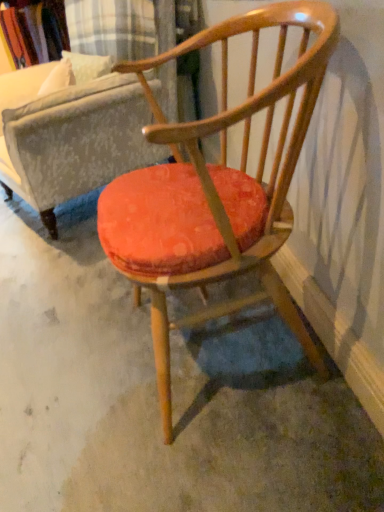
Question: Is wooden armchair at center closer to the viewer compared to orange fabric cushion at center?

Choices:
 (A) no
 (B) yes

Answer: (B)

Question: Is wooden armchair at center looking in the opposite direction of orange fabric cushion at center?

Choices:
 (A) yes
 (B) no

Answer: (B)

Question: From a real-world perspective, does wooden armchair at center sit lower than orange fabric cushion at center?

Choices:
 (A) yes
 (B) no

Answer: (B)

Question: Is wooden armchair at center positioned behind orange fabric cushion at center?

Choices:
 (A) no
 (B) yes

Answer: (A)

Question: Is wooden armchair at center far away from orange fabric cushion at center?

Choices:
 (A) no
 (B) yes

Answer: (A)

Question: Is velvet orange cushion at center bigger or smaller than wooden armchair at center?

Choices:
 (A) small
 (B) big

Answer: (B)

Question: From a real-world perspective, is velvet orange cushion at center above or below wooden armchair at center?

Choices:
 (A) above
 (B) below

Answer: (A)

Question: Is velvet orange cushion at center taller or shorter than wooden armchair at center?

Choices:
 (A) short
 (B) tall

Answer: (B)

Question: From the image's perspective, is velvet orange cushion at center positioned above or below wooden armchair at center?

Choices:
 (A) above
 (B) below

Answer: (A)

Question: Would you say orange fabric cushion at center is inside or outside velvet orange cushion at center?

Choices:
 (A) inside
 (B) outside

Answer: (B)

Question: Looking at their shapes, would you say orange fabric cushion at center is wider or thinner than velvet orange cushion at center?

Choices:
 (A) wide
 (B) thin

Answer: (A)

Question: Based on their sizes in the image, would you say orange fabric cushion at center is bigger or smaller than velvet orange cushion at center?

Choices:
 (A) small
 (B) big

Answer: (A)

Question: Is orange fabric cushion at center to the left or to the right of velvet orange cushion at center in the image?

Choices:
 (A) left
 (B) right

Answer: (B)

Question: Looking at their shapes, would you say wooden armchair at center is wider or thinner than velvet orange cushion at center?

Choices:
 (A) wide
 (B) thin

Answer: (B)

Question: In terms of size, does wooden armchair at center appear bigger or smaller than velvet orange cushion at center?

Choices:
 (A) small
 (B) big

Answer: (A)